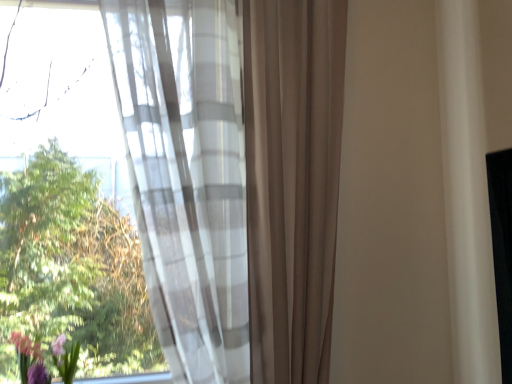
Question: In the image, is sheer white curtain at left positioned in front of or behind purple matte floral arrangement at lower left?

Choices:
 (A) front
 (B) behind

Answer: (A)

Question: Which is correct: sheer white curtain at left is inside purple matte floral arrangement at lower left, or outside of it?

Choices:
 (A) outside
 (B) inside

Answer: (A)

Question: In terms of width, does sheer white curtain at left look wider or thinner when compared to purple matte floral arrangement at lower left?

Choices:
 (A) wide
 (B) thin

Answer: (A)

Question: From the image's perspective, relative to sheer white curtain at left, is purple matte floral arrangement at lower left above or below?

Choices:
 (A) above
 (B) below

Answer: (B)

Question: Is purple matte floral arrangement at lower left bigger or smaller than sheer white curtain at left?

Choices:
 (A) big
 (B) small

Answer: (B)

Question: Is purple matte floral arrangement at lower left taller or shorter than sheer white curtain at left?

Choices:
 (A) tall
 (B) short

Answer: (B)

Question: From a real-world perspective, is purple matte floral arrangement at lower left above or below sheer white curtain at left?

Choices:
 (A) below
 (B) above

Answer: (A)